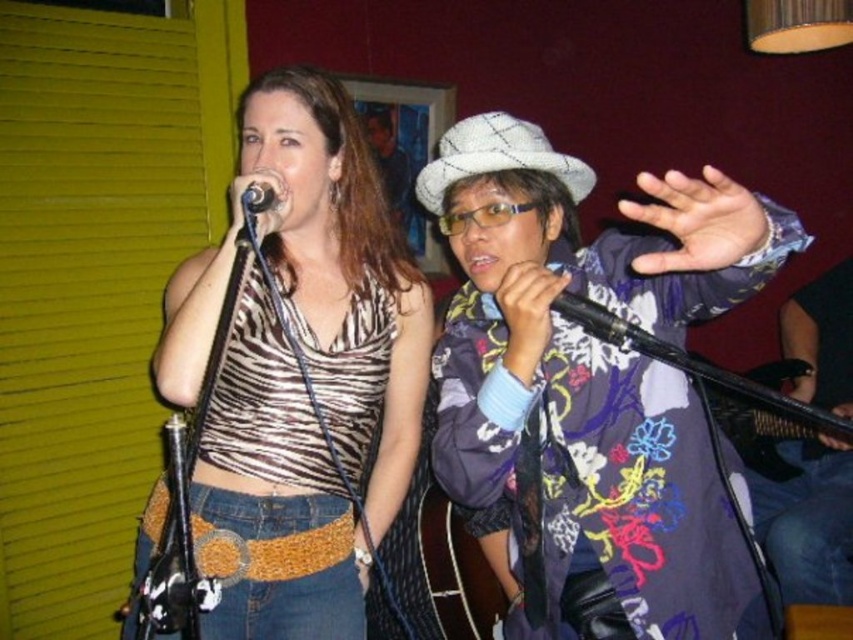
You are a photographer setting up for a live performance. You need to position your camera so that both the floral fabric instrument at center and the black matte microphone at upper center are in frame. Based on their positions, which object should you focus on first to ensure both are captured clearly?

The floral fabric instrument at center is located below the black matte microphone at upper center, so you should focus on the black matte microphone at upper center first as it is higher up and will help frame the shot to include both objects.